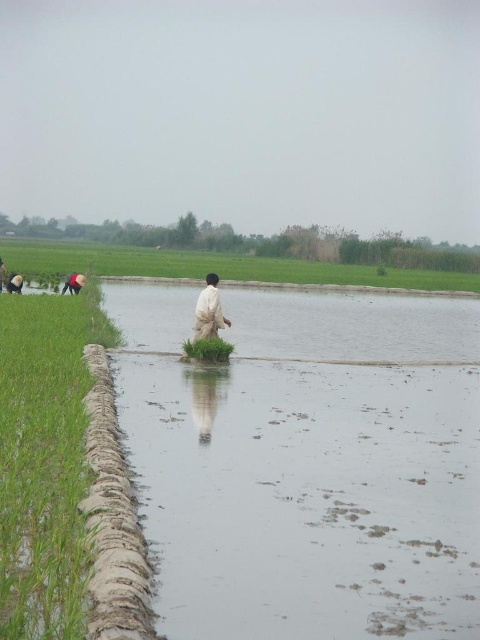
Question: Is green grass at left below matte black person at lower left?

Choices:
 (A) no
 (B) yes

Answer: (B)

Question: Can you confirm if green grass at left is positioned above muddy dirt trench at left?

Choices:
 (A) no
 (B) yes

Answer: (B)

Question: Which object appears farthest from the camera in this image?

Choices:
 (A) green grass at center
 (B) matte black person at lower left
 (C) green grass at lower left

Answer: (C)

Question: Which point is closer to the camera taking this photo?

Choices:
 (A) (95, 356)
 (B) (81, 276)
 (C) (61, 513)
 (D) (195, 340)

Answer: (C)

Question: Among these objects, which one is nearest to the camera?

Choices:
 (A) green grass at lower left
 (B) matte black person at lower left
 (C) green grass at center

Answer: (C)

Question: Observing the image, what is the correct spatial positioning of green grass at lower left in reference to matte black person at lower left?

Choices:
 (A) left
 (B) right

Answer: (B)